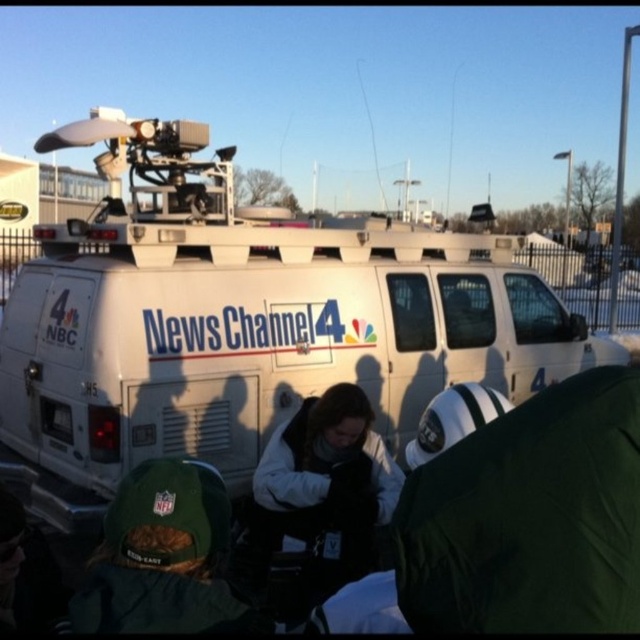
Which of these two, white van at center or green fabric jacket at lower right, stands taller?

Standing taller between the two is white van at center.

Measure the distance from white van at center to green fabric jacket at lower right.

white van at center is 3.50 meters from green fabric jacket at lower right.

Locate an element on the screen. The image size is (640, 640). white van at center is located at coordinates (248, 317).

Locate an element on the screen. white van at center is located at coordinates (248, 317).

Who is shorter, white van at center or green fabric cap at lower left?

green fabric cap at lower left

Which is behind, point (422, 234) or point (122, 632)?

The point (422, 234) is more distant.

I want to click on white van at center, so click(248, 317).

Who is taller, green fabric cap at lower left or white fleece jacket at center?

With more height is white fleece jacket at center.

Between point (161, 522) and point (336, 547), which one is positioned behind?

Positioned behind is point (336, 547).

Who is more forward, (x=202, y=566) or (x=358, y=536)?

Point (x=202, y=566) is more forward.

The image size is (640, 640). I want to click on green fabric cap at lower left, so click(163, 557).